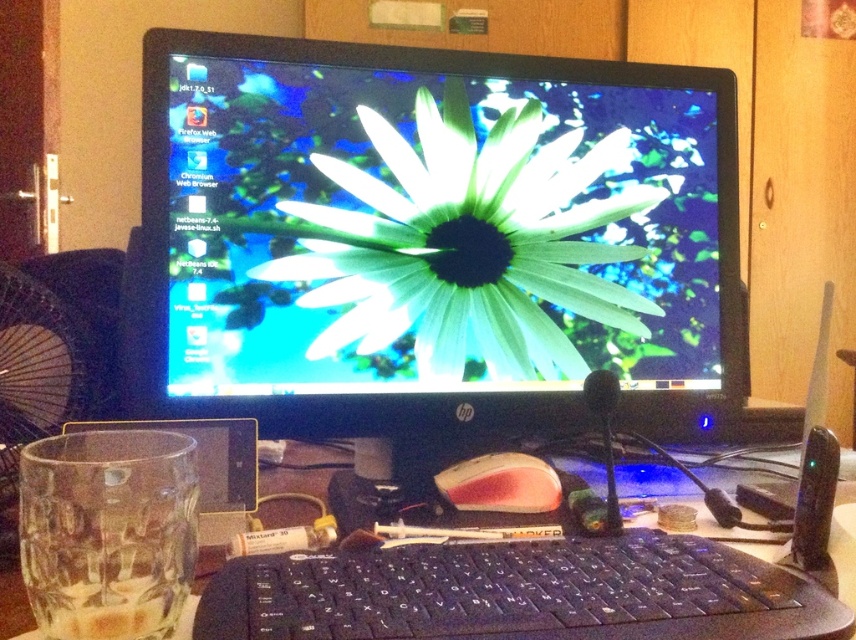
Is green matte flower at center to the right of black plastic keyboard at lower center from the viewer's perspective?

Correct, you'll find green matte flower at center to the right of black plastic keyboard at lower center.

Between point (521, 145) and point (415, 557), which one is positioned behind?

The point (521, 145) is behind.

At what (x,y) coordinates should I click in order to perform the action: click on green matte flower at center. Please return your answer as a coordinate pair (x, y). This screenshot has width=856, height=640. Looking at the image, I should click on (468, 244).

Between black plastic keyboard at center and black plastic keyboard at lower center, which one is positioned lower?

Positioned lower is black plastic keyboard at lower center.

Can you confirm if black plastic keyboard at center is positioned below black plastic keyboard at lower center?

Incorrect, black plastic keyboard at center is not positioned below black plastic keyboard at lower center.

Between point (801, 596) and point (562, 600), which one is positioned in front?

Point (562, 600)

You are a GUI agent. You are given a task and a screenshot of the screen. Output one action in this format:
    pyautogui.click(x=<x>, y=<y>)
    Task: Click on the black plastic keyboard at center
    This screenshot has width=856, height=640.
    Given the screenshot: What is the action you would take?
    [519, 593]

Is black plastic keyboard at center smaller than pink matte mouse at center?

No, black plastic keyboard at center is not smaller than pink matte mouse at center.

Looking at this image, can you confirm if black plastic keyboard at center is positioned to the left of pink matte mouse at center?

Correct, you'll find black plastic keyboard at center to the left of pink matte mouse at center.

What do you see at coordinates (519, 593) in the screenshot? The width and height of the screenshot is (856, 640). I see `black plastic keyboard at center` at bounding box center [519, 593].

At what (x,y) coordinates should I click in order to perform the action: click on black plastic keyboard at center. Please return your answer as a coordinate pair (x, y). This screenshot has height=640, width=856. Looking at the image, I should click on (519, 593).